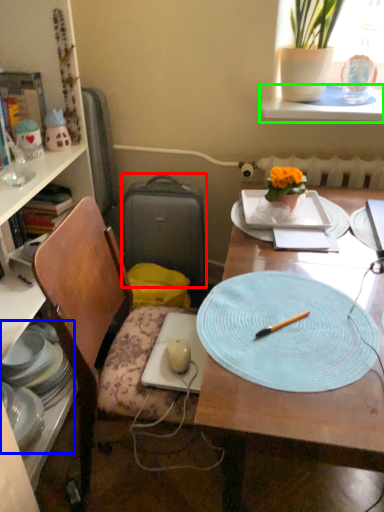
Question: Which object is positioned farthest from luggage (highlighted by a red box)? Select from tableware (highlighted by a blue box) and window sill (highlighted by a green box).

Choices:
 (A) tableware
 (B) window sill

Answer: (B)